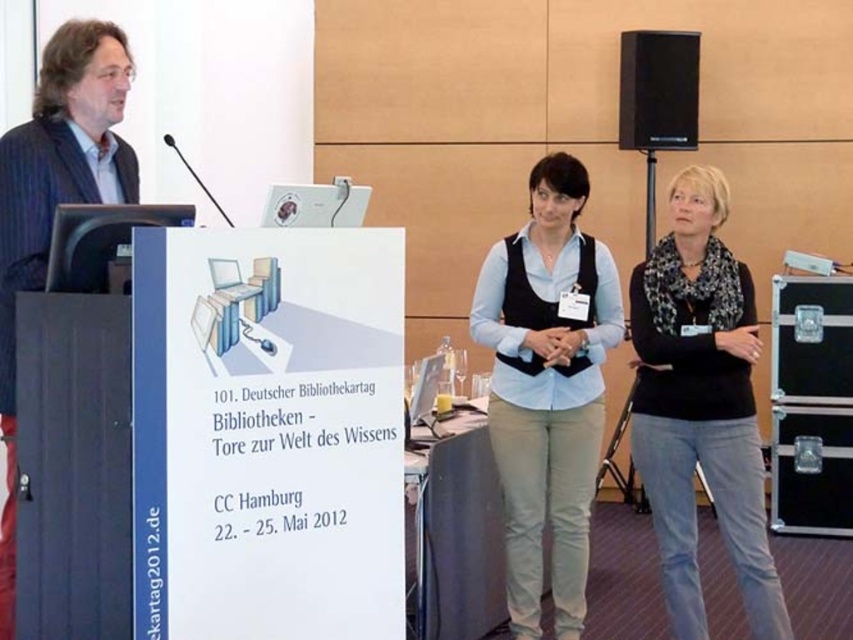
Question: Is black knitwear at right positioned at the back of dark blue suit at left?

Choices:
 (A) no
 (B) yes

Answer: (B)

Question: Which object is positioned closest to the black knitwear at right?

Choices:
 (A) light blue cotton shirt at center
 (B) black matte speaker at upper right
 (C) dark blue suit at left

Answer: (A)

Question: Is the position of dark blue suit at left less distant than that of black matte speaker at upper right?

Choices:
 (A) yes
 (B) no

Answer: (A)

Question: Does black knitwear at right appear on the left side of black matte speaker at upper right?

Choices:
 (A) yes
 (B) no

Answer: (A)

Question: Which point appears closest to the camera in this image?

Choices:
 (A) (6, 552)
 (B) (708, 404)
 (C) (564, 348)

Answer: (A)

Question: Which of the following is the farthest from the observer?

Choices:
 (A) (660, 100)
 (B) (88, 150)
 (C) (532, 470)

Answer: (A)